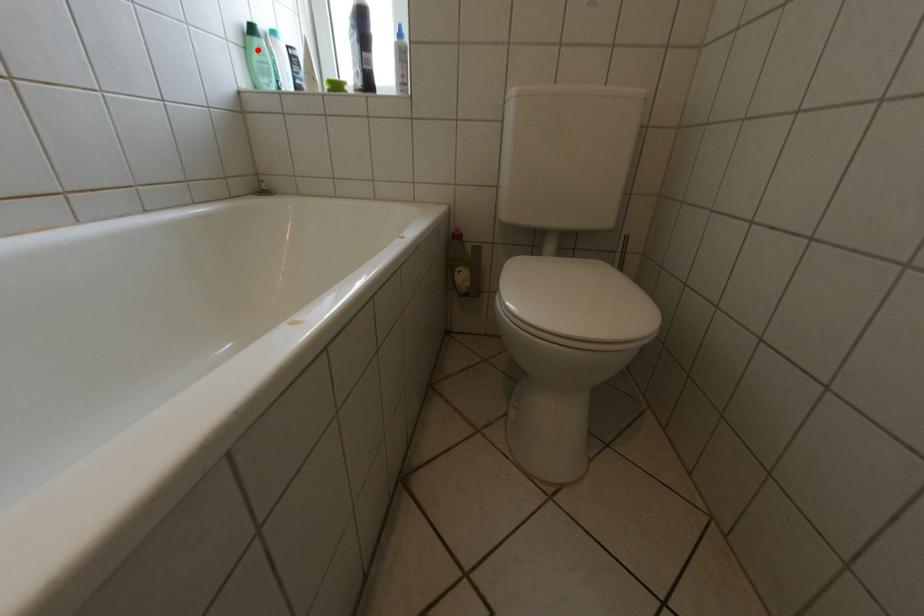
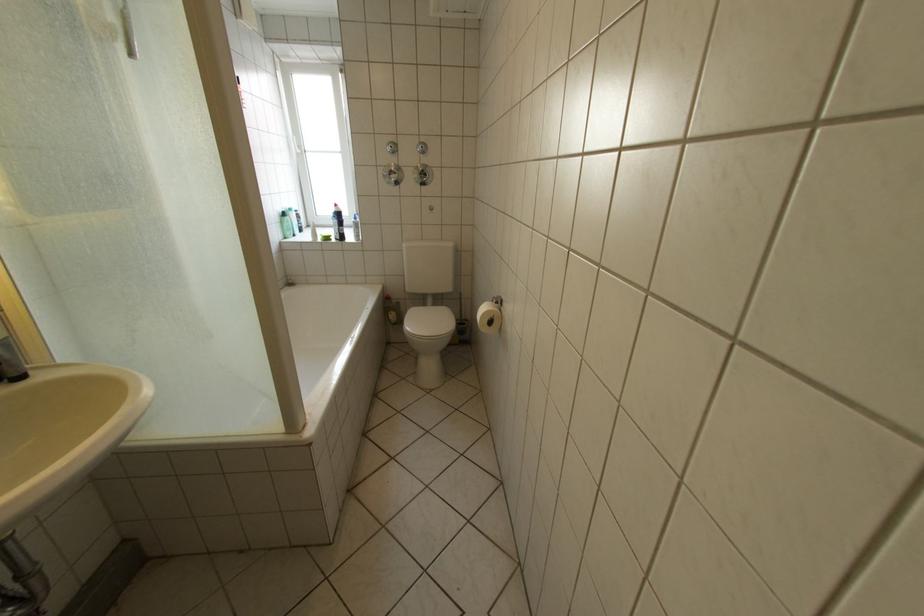
Question: I am providing you with two images of the same scene from different viewpoints. A red point is shown in image1. For the corresponding object point in image2, is it positioned nearer or farther from the camera?

Choices:
 (A) Nearer
 (B) Farther

Answer: (A)